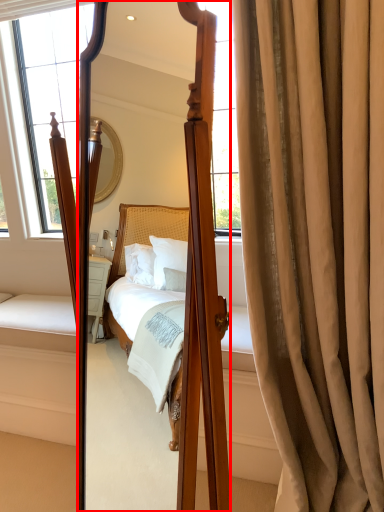
Question: In this image, where is mirror (annotated by the red box) located relative to curtain?

Choices:
 (A) right
 (B) left

Answer: (B)